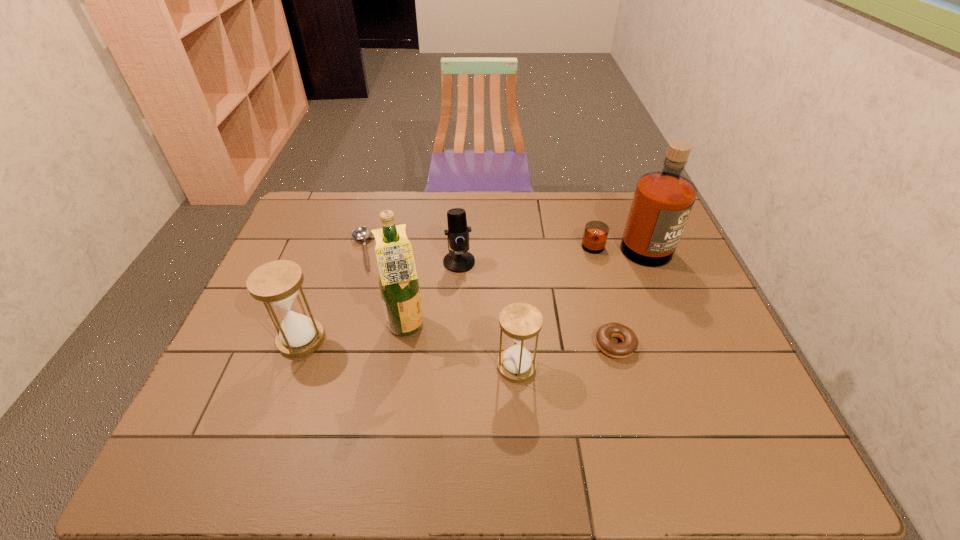
All hourglasss are currently evenly spaced. To continue this pattern, where would you add another hourglass on the right? Please point out a vacant spot. Please provide its 2D coordinates. Your answer should be formatted as a tuple, i.e. [(x, y)], where the tuple contains the x and y coordinates of a point satisfying the conditions above.

[(756, 396)]